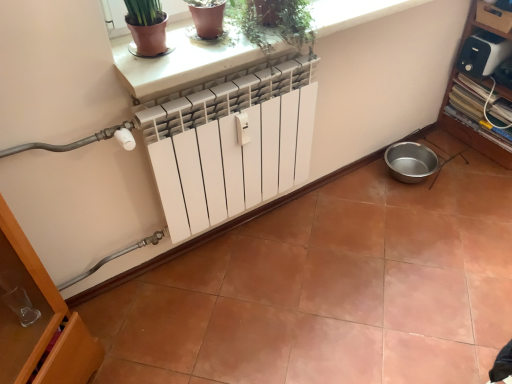
Question: From the image's perspective, is green matte plant at upper center above white smooth ledge at upper center?

Choices:
 (A) no
 (B) yes

Answer: (A)

Question: From a real-world perspective, is green matte plant at upper center on top of white smooth ledge at upper center?

Choices:
 (A) no
 (B) yes

Answer: (B)

Question: From a real-world perspective, does green matte plant at upper center sit lower than white smooth ledge at upper center?

Choices:
 (A) no
 (B) yes

Answer: (A)

Question: Could white smooth ledge at upper center be considered to be inside green matte plant at upper center?

Choices:
 (A) yes
 (B) no

Answer: (B)

Question: From the image's perspective, is green matte plant at upper center under white smooth ledge at upper center?

Choices:
 (A) yes
 (B) no

Answer: (A)

Question: Is green matte plant at upper center not within white smooth ledge at upper center?

Choices:
 (A) no
 (B) yes

Answer: (B)

Question: Is white smooth ledge at upper center positioned in front of white glossy radiator at center?

Choices:
 (A) yes
 (B) no

Answer: (B)

Question: Is white smooth ledge at upper center facing away from white glossy radiator at center?

Choices:
 (A) no
 (B) yes

Answer: (A)

Question: Is white glossy radiator at center located within white smooth ledge at upper center?

Choices:
 (A) yes
 (B) no

Answer: (B)

Question: Does white smooth ledge at upper center have a lesser width compared to white glossy radiator at center?

Choices:
 (A) no
 (B) yes

Answer: (B)

Question: Is white smooth ledge at upper center far away from white glossy radiator at center?

Choices:
 (A) yes
 (B) no

Answer: (B)

Question: Can you confirm if white smooth ledge at upper center is bigger than white glossy radiator at center?

Choices:
 (A) no
 (B) yes

Answer: (A)

Question: Does green matte plant at upper center lie in front of white glossy radiator at center?

Choices:
 (A) yes
 (B) no

Answer: (B)